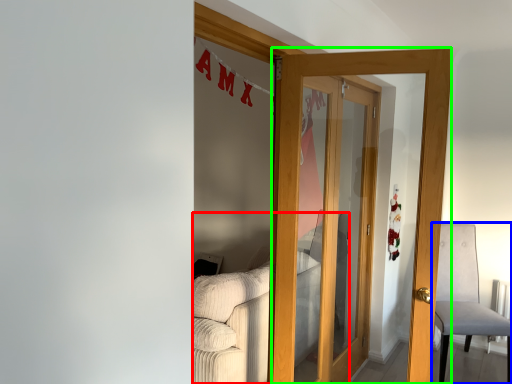
Question: Which object is positioned farthest from couch (highlighted by a red box)? Select from chair (highlighted by a blue box) and door (highlighted by a green box).

Choices:
 (A) chair
 (B) door

Answer: (A)